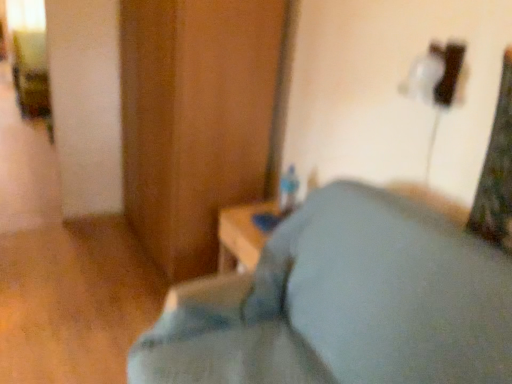
Question: From a real-world perspective, does light blue fabric pillow at lower center stand above wooden dresser at center?

Choices:
 (A) no
 (B) yes

Answer: (A)

Question: From the image's perspective, would you say light blue fabric pillow at lower center is positioned over wooden dresser at center?

Choices:
 (A) yes
 (B) no

Answer: (B)

Question: Considering the relative sizes of light blue fabric pillow at lower center and wooden dresser at center in the image provided, is light blue fabric pillow at lower center shorter than wooden dresser at center?

Choices:
 (A) no
 (B) yes

Answer: (B)

Question: Does light blue fabric pillow at lower center have a smaller size compared to wooden dresser at center?

Choices:
 (A) yes
 (B) no

Answer: (A)

Question: Is light blue fabric pillow at lower center closer to the viewer compared to wooden dresser at center?

Choices:
 (A) no
 (B) yes

Answer: (B)

Question: Considering the relative positions of light blue fabric pillow at lower center and wooden dresser at center in the image provided, is light blue fabric pillow at lower center to the right of wooden dresser at center from the viewer's perspective?

Choices:
 (A) yes
 (B) no

Answer: (A)

Question: From a real-world perspective, is wooden dresser at center positioned under light blue fabric pillow at lower center based on gravity?

Choices:
 (A) yes
 (B) no

Answer: (B)

Question: From a real-world perspective, is wooden dresser at center on top of light blue fabric pillow at lower center?

Choices:
 (A) yes
 (B) no

Answer: (A)

Question: Is wooden dresser at center behind light blue fabric pillow at lower center?

Choices:
 (A) no
 (B) yes

Answer: (B)

Question: Is wooden dresser at center to the left of light blue fabric pillow at lower center from the viewer's perspective?

Choices:
 (A) no
 (B) yes

Answer: (B)

Question: Is wooden dresser at center touching light blue fabric pillow at lower center?

Choices:
 (A) no
 (B) yes

Answer: (A)

Question: From the image's perspective, does wooden dresser at center appear lower than light blue fabric pillow at lower center?

Choices:
 (A) no
 (B) yes

Answer: (A)

Question: In terms of width, does wooden dresser at center look wider or thinner when compared to light blue fabric pillow at lower center?

Choices:
 (A) wide
 (B) thin

Answer: (B)